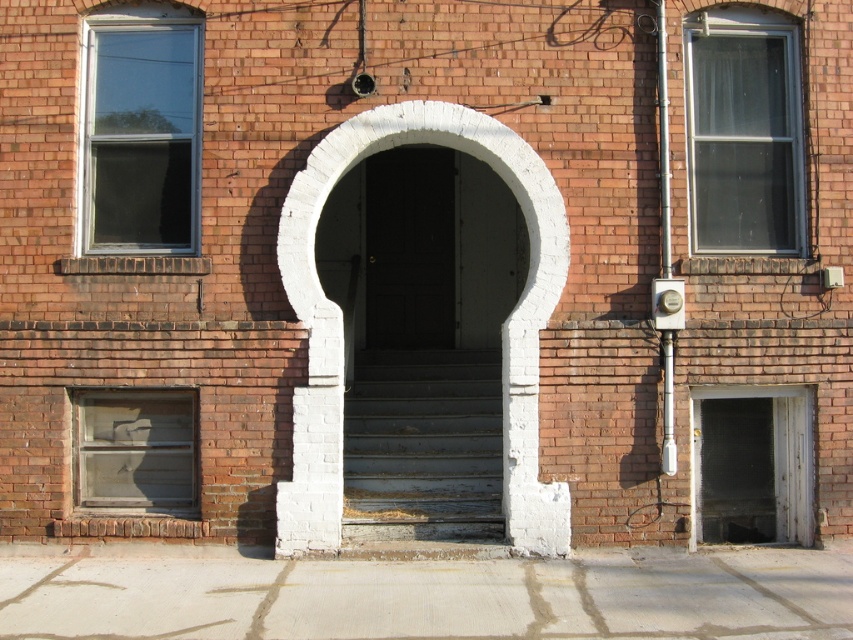
Question: Does rusty metal stairs at center have a greater width compared to clear glass window at lower left?

Choices:
 (A) no
 (B) yes

Answer: (B)

Question: Does clear glass window at upper left appear on the right side of white mesh screen door at lower right?

Choices:
 (A) yes
 (B) no

Answer: (B)

Question: Where is white plaster archway at center located in relation to white mesh screen door at lower right in the image?

Choices:
 (A) below
 (B) above

Answer: (B)

Question: Which point is farther to the camera?

Choices:
 (A) tap(798, 460)
 (B) tap(334, 317)

Answer: (A)

Question: Which point is farther to the camera?

Choices:
 (A) (705, 120)
 (B) (554, 182)
 (C) (167, 241)
 (D) (808, 403)

Answer: (A)

Question: Among these objects, which one is nearest to the camera?

Choices:
 (A) clear glass window at lower left
 (B) white mesh screen door at lower right
 (C) rusty metal stairs at center
 (D) clear glass window at upper left

Answer: (C)